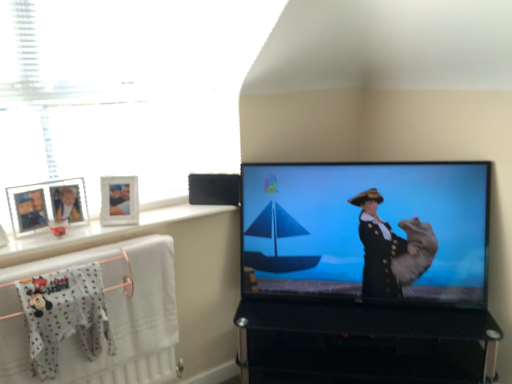
Question: Is white glossy window sill at upper left taller or shorter than white cotton onesie at lower left?

Choices:
 (A) short
 (B) tall

Answer: (A)

Question: Considering the positions of point (190, 205) and point (86, 301), is point (190, 205) closer or farther from the camera than point (86, 301)?

Choices:
 (A) farther
 (B) closer

Answer: (A)

Question: Which object is positioned closest to the black glass tv stand at lower right?

Choices:
 (A) white cotton onesie at lower left
 (B) white textured towel at lower left
 (C) white glossy window sill at upper left
 (D) white fabric hanger at lower left
 (E) white plastic picture frame at upper left

Answer: (B)

Question: Estimate the real-world distances between objects in this image. Which object is farther from the black glass tv stand at lower right?

Choices:
 (A) white textured towel at lower left
 (B) matte black screen at right
 (C) black plastic speaker at upper center
 (D) white cotton onesie at lower left
 (E) white glossy window sill at upper left

Answer: (D)